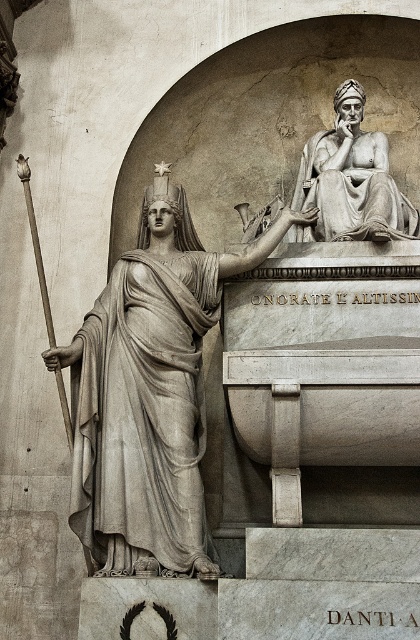
Question: Which point is closer to the camera?

Choices:
 (A) gray stone statue at left
 (B) wooden spear at left

Answer: (A)

Question: Can you confirm if matte gray statue at upper right is thinner than wooden spear at left?

Choices:
 (A) no
 (B) yes

Answer: (A)

Question: Is gray stone statue at left behind matte gray statue at upper right?

Choices:
 (A) no
 (B) yes

Answer: (A)

Question: Among these objects, which one is nearest to the camera?

Choices:
 (A) matte gray statue at upper right
 (B) gray stone statue at left
 (C) wooden spear at left

Answer: (B)

Question: Can you confirm if gray stone statue at left is thinner than matte gray statue at upper right?

Choices:
 (A) yes
 (B) no

Answer: (B)

Question: Which of the following is the farthest from the observer?

Choices:
 (A) matte gray statue at upper right
 (B) gray stone statue at left

Answer: (A)